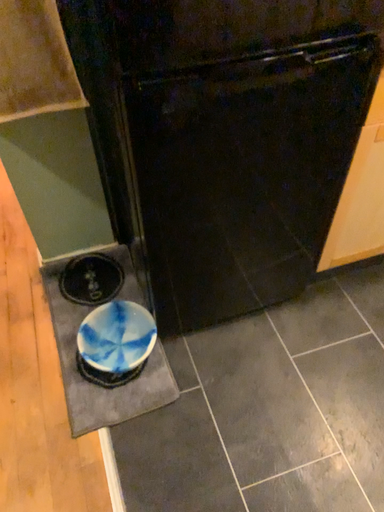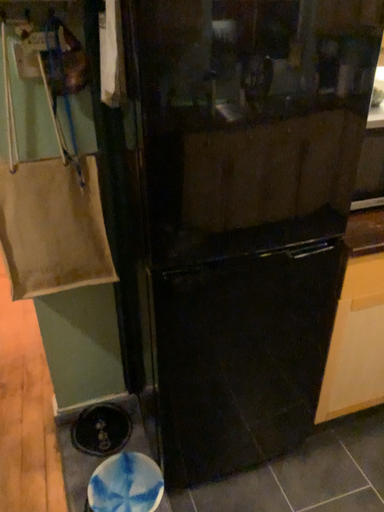
Question: Which way did the camera rotate in the video?

Choices:
 (A) rotated upward
 (B) rotated downward

Answer: (A)